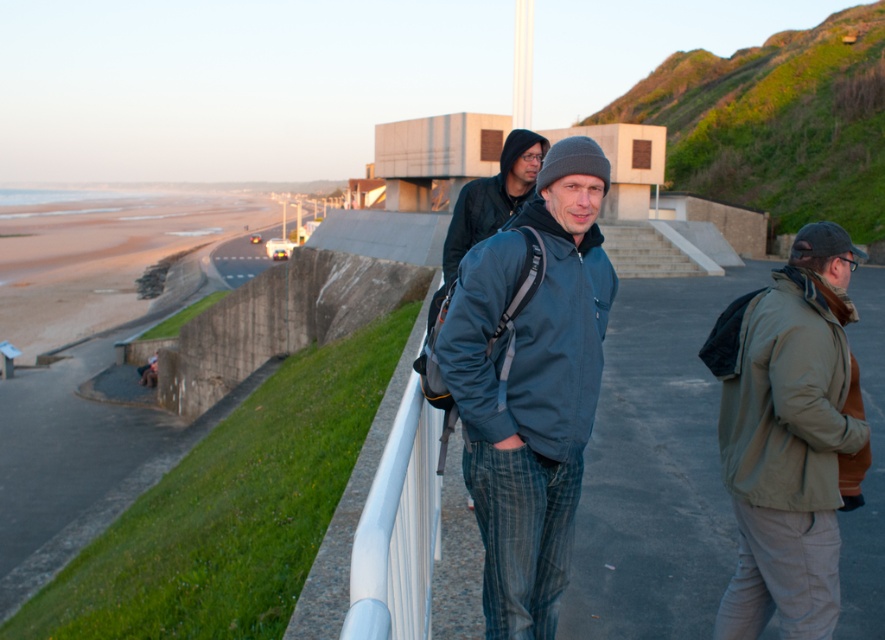
Consider the image. You are a photographer trying to capture both the matte blue jacket at center and the khaki fabric jacket at right in a single frame. Based on their sizes, which jacket would appear closer to the camera?

The matte blue jacket at center appears closer to the camera because it has a smaller size compared to the khaki fabric jacket at right.

You are a photographer positioned behind the khaki fabric jacket at right and dark blue jacket at center. You want to take a photo that includes both jackets in focus. Which jacket should you focus on to ensure both are sharp?

You should focus on the dark blue jacket at center because it is farther away than the khaki fabric jacket at right, so focusing on the farther object will keep both in focus.

You are a photographer aiming to capture both the matte blue jacket at center and the dark blue jacket at center in a single frame. Based on their heights, which jacket will appear taller in the photo?

The matte blue jacket at center will appear taller in the photo because it has a greater height compared to the dark blue jacket at center according to the description.